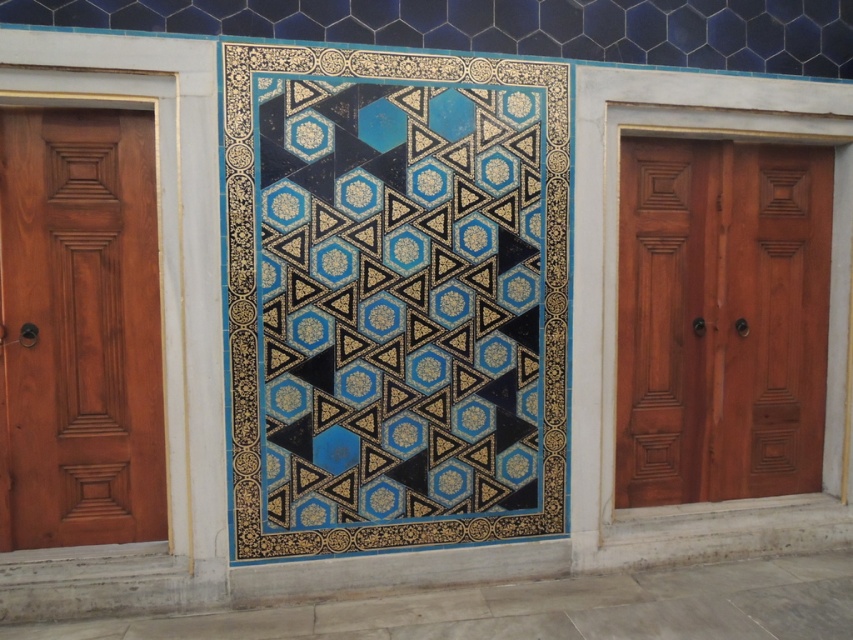
You are a painter standing at the base of the wall. You need to paint the mahogany wood door at left and the blue glossy tile at center. Which object is taller so you know where to aim your ladder higher?

The blue glossy tile at center is taller than the mahogany wood door at left, so you should aim your ladder higher for the blue glossy tile at center.

You are an interior designer assessing the wall decor. Given the blue glossy tile at center and the mahogany wood door at right, which object would you say occupies more space on the wall?

The blue glossy tile at center occupies more space on the wall since it is larger in size than the mahogany wood door at right.